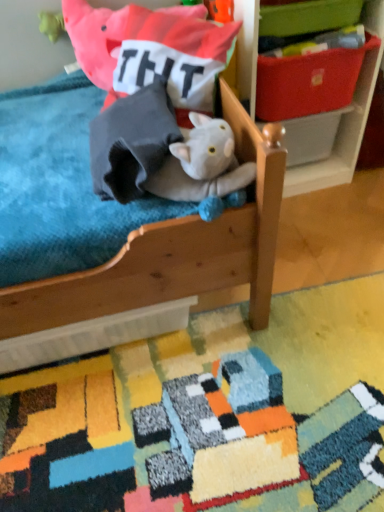
The height and width of the screenshot is (512, 384). What are the coordinates of `free spot below multicolored textured rug at lower center (from a real-world perspective)` in the screenshot? It's located at (217, 437).